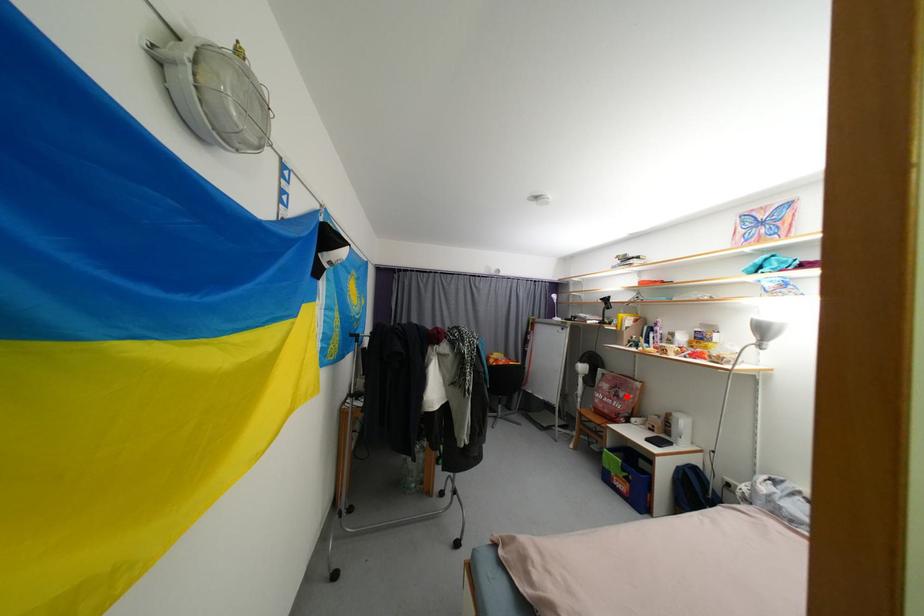
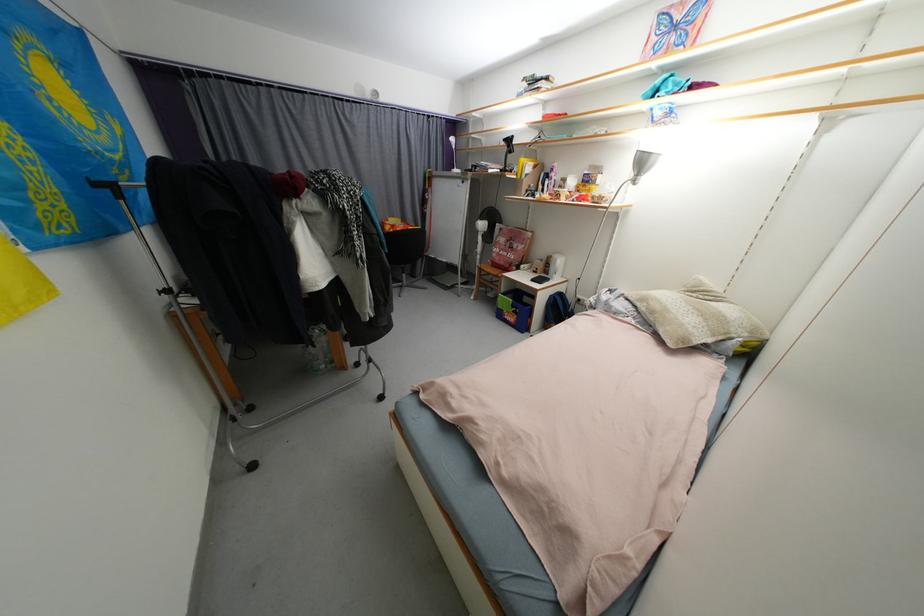
The point at the highlighted location is marked in the first image. Where is the corresponding point in the second image?

(520, 248)